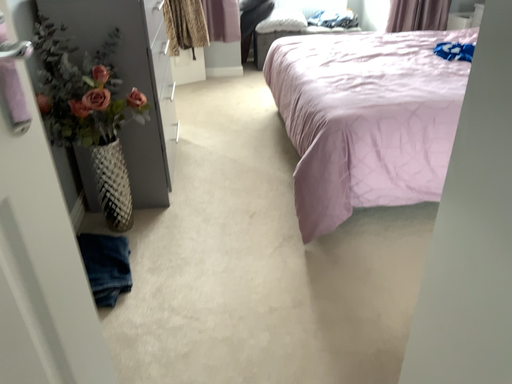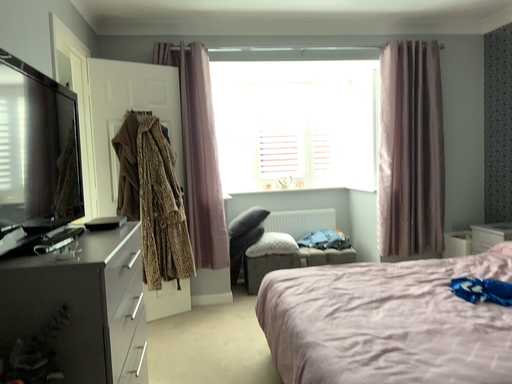
Question: Which way did the camera rotate in the video?

Choices:
 (A) rotated upward
 (B) rotated downward

Answer: (A)